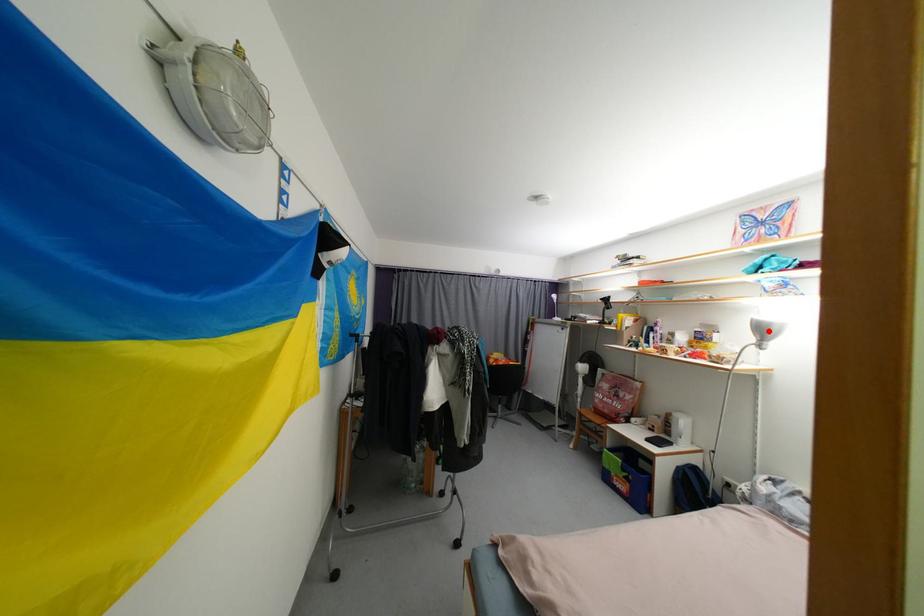
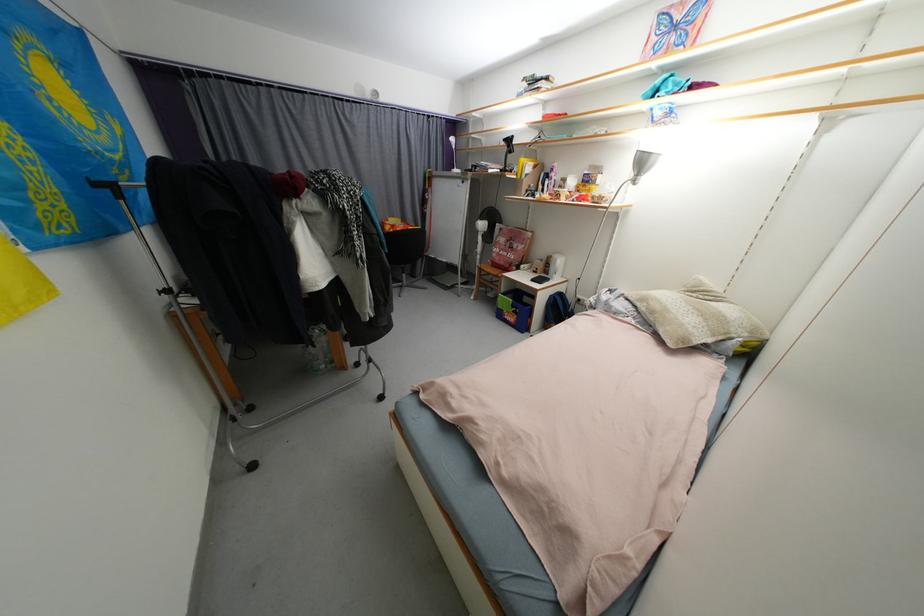
The point at the highlighted location is marked in the first image. Where is the corresponding point in the second image?

(648, 164)